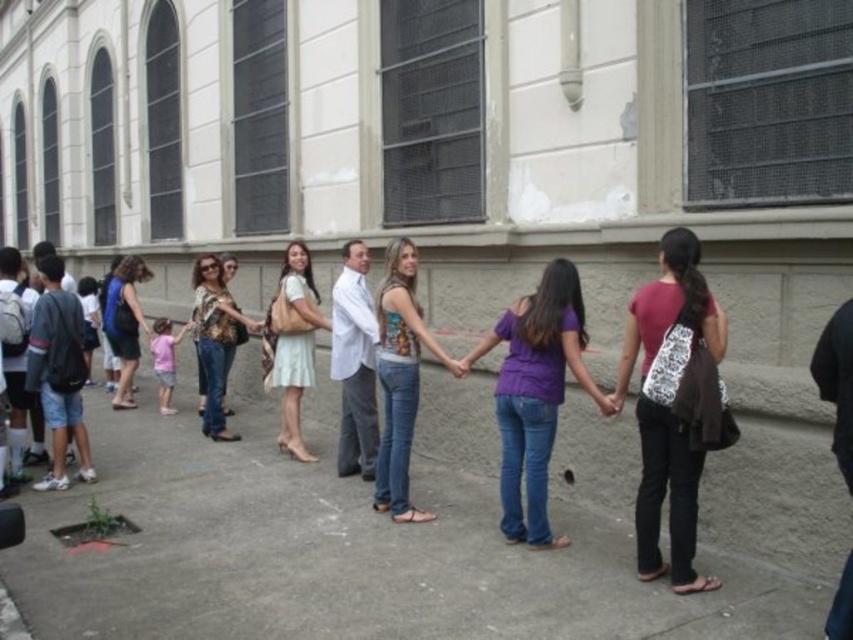
Which of these two, gray concrete pavement at center or blue denim jeans at left, stands shorter?

Standing shorter between the two is gray concrete pavement at center.

Is gray concrete pavement at center further to the viewer compared to blue denim jeans at left?

No, it is in front of blue denim jeans at left.

This screenshot has height=640, width=853. Find the location of `gray concrete pavement at center`. gray concrete pavement at center is located at coordinates (393, 540).

Does purple matte shirt at center have a lesser height compared to light green fabric dress at center?

Yes.

I want to click on purple matte shirt at center, so click(x=535, y=394).

Does point (407, 257) come closer to viewer compared to point (109, 289)?

Yes, it is in front of point (109, 289).

Can you confirm if printed fabric tank top at center is positioned to the right of blue denim jeans at left?

Indeed, printed fabric tank top at center is positioned on the right side of blue denim jeans at left.

You are a GUI agent. You are given a task and a screenshot of the screen. Output one action in this format:
    pyautogui.click(x=<x>, y=<y>)
    Task: Click on the printed fabric tank top at center
    
    Given the screenshot: What is the action you would take?
    pyautogui.click(x=399, y=378)

Find the location of a particular element. Image resolution: width=853 pixels, height=640 pixels. printed fabric tank top at center is located at coordinates (399, 378).